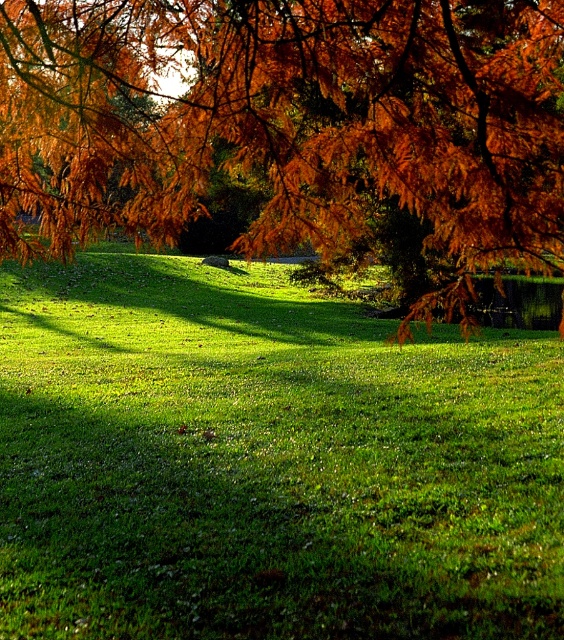
You are standing on the green grassy at center and looking up. Which direction should you look to see the orange leafy branch at upper center?

The orange leafy branch at upper center is above the green grassy at center, so you should look upward to see it.

You are standing in the middle of the green grassy at center and want to pick the orange leafy branch at upper center. Can you reach it without moving your feet?

The green grassy at center is 4.24 meters away from the orange leafy branch at upper center. Since the distance is quite far, you cannot reach the orange leafy branch at upper center without moving your feet.